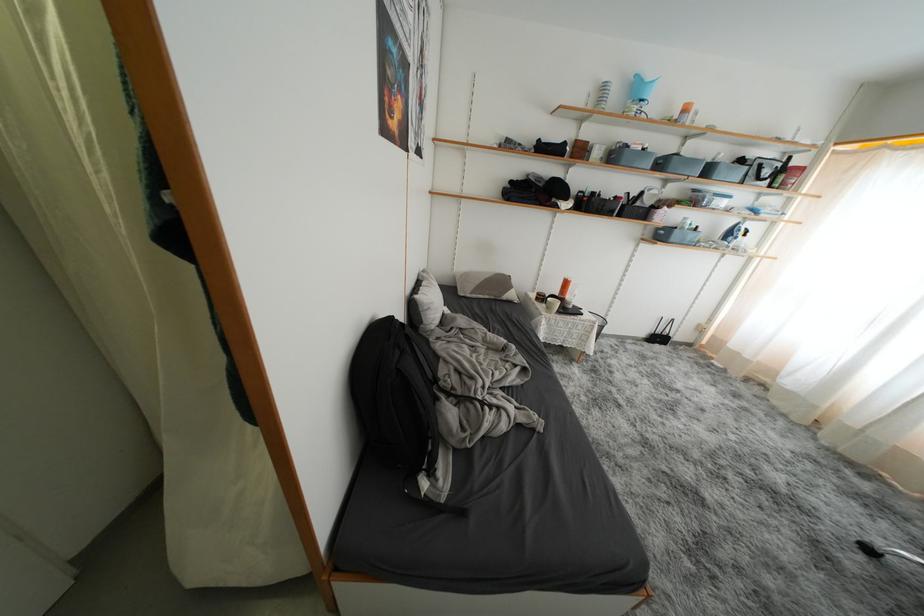
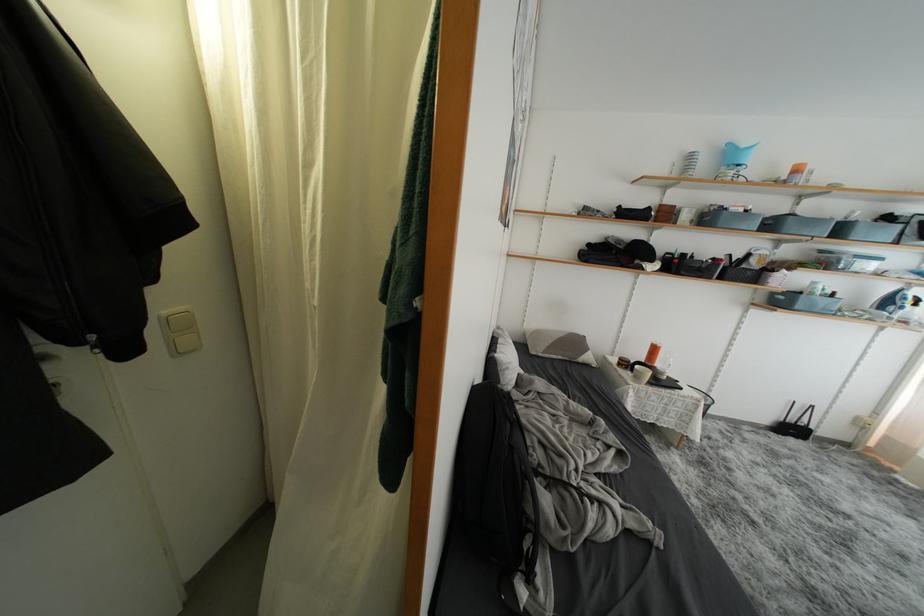
Where in the second image is the point corresponding to point (714, 175) from the first image?

(847, 235)